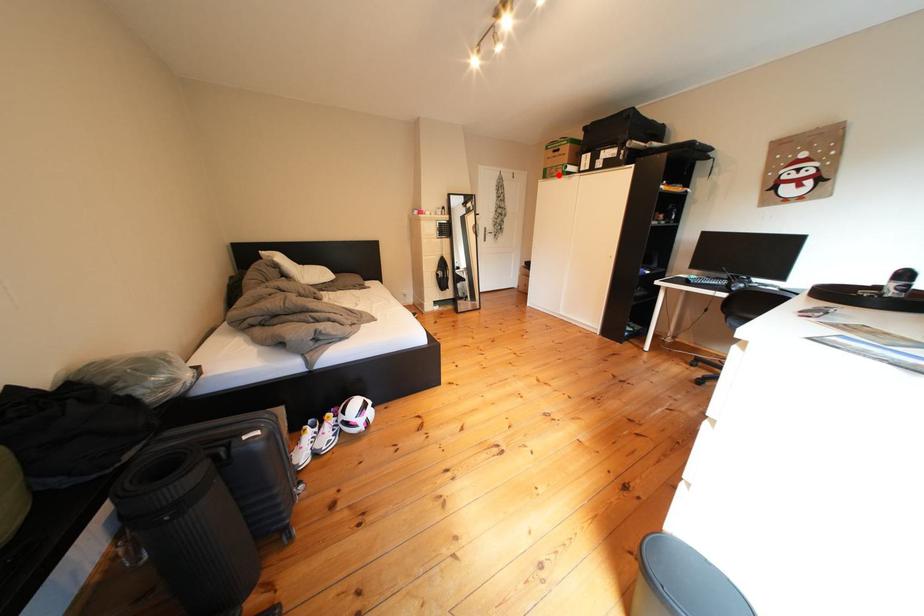
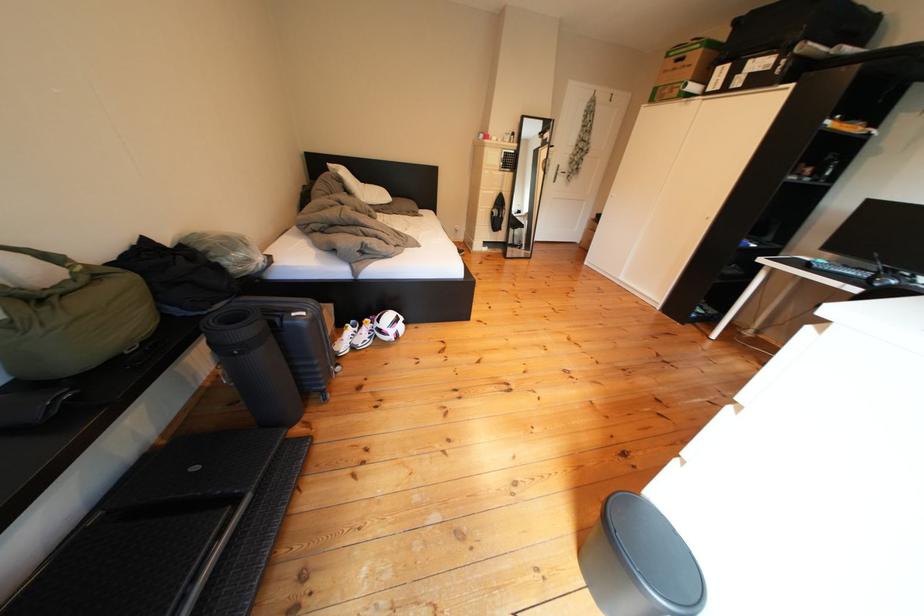
In the second image, find the point that corresponds to the highlighted location in the first image.

(670, 95)